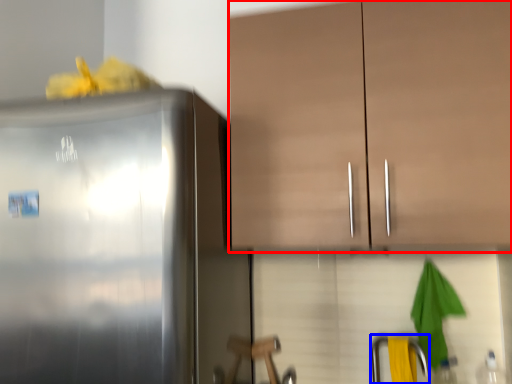
Question: Which object appears closest to the camera in this image, cabinetry (highlighted by a red box) or faucet (highlighted by a blue box)?

Choices:
 (A) cabinetry
 (B) faucet

Answer: (A)